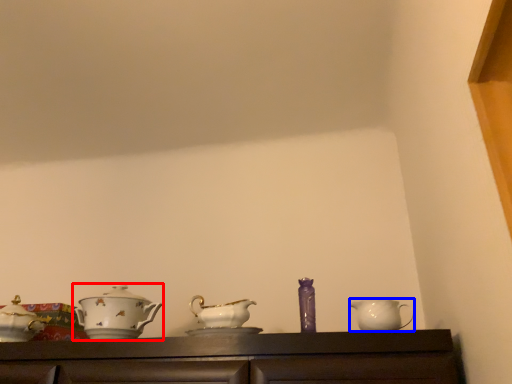
Question: Which object is further to the camera taking this photo, tableware (highlighted by a red box) or jug (highlighted by a blue box)?

Choices:
 (A) tableware
 (B) jug

Answer: (A)